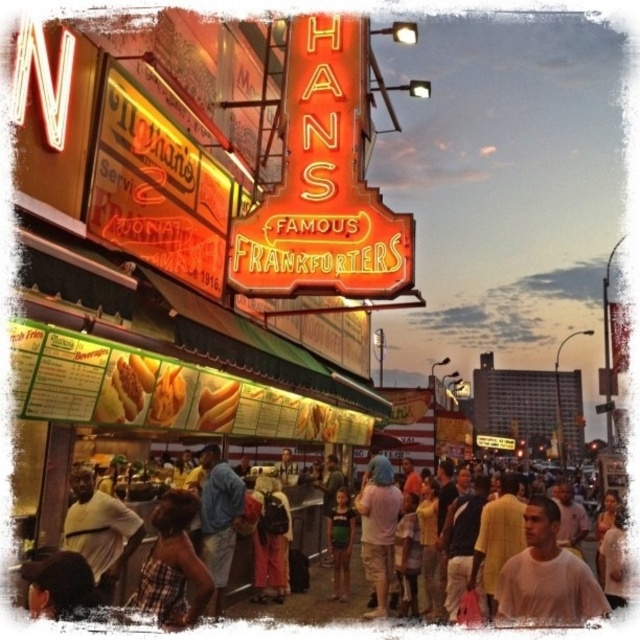
Can you confirm if light beige cotton shirt at center is wider than white t-shirt at lower left?

Indeed, light beige cotton shirt at center has a greater width compared to white t-shirt at lower left.

Is point (552, 556) closer to viewer compared to point (99, 544)?

No.

Identify the location of light beige cotton shirt at center. This screenshot has height=640, width=640. (547, 573).

This screenshot has height=640, width=640. Describe the element at coordinates (547, 573) in the screenshot. I see `light beige cotton shirt at center` at that location.

Does point (547, 576) lie behind point (241, 493)?

No, (547, 576) is closer to viewer.

Between point (566, 618) and point (227, 552), which one is positioned in front?

Point (566, 618) is in front.

Where is `light beige cotton shirt at center`? The height and width of the screenshot is (640, 640). light beige cotton shirt at center is located at coordinates (547, 573).

Based on the photo, does light beige cotton shirt at center have a greater width compared to light brown fabric shirt at lower center?

Incorrect, light beige cotton shirt at center's width does not surpass light brown fabric shirt at lower center's.

Which is more to the left, light beige cotton shirt at center or light brown fabric shirt at lower center?

light brown fabric shirt at lower center is more to the left.

The image size is (640, 640). Describe the element at coordinates (547, 573) in the screenshot. I see `light beige cotton shirt at center` at that location.

Where is `light beige cotton shirt at center`? The width and height of the screenshot is (640, 640). light beige cotton shirt at center is located at coordinates (547, 573).